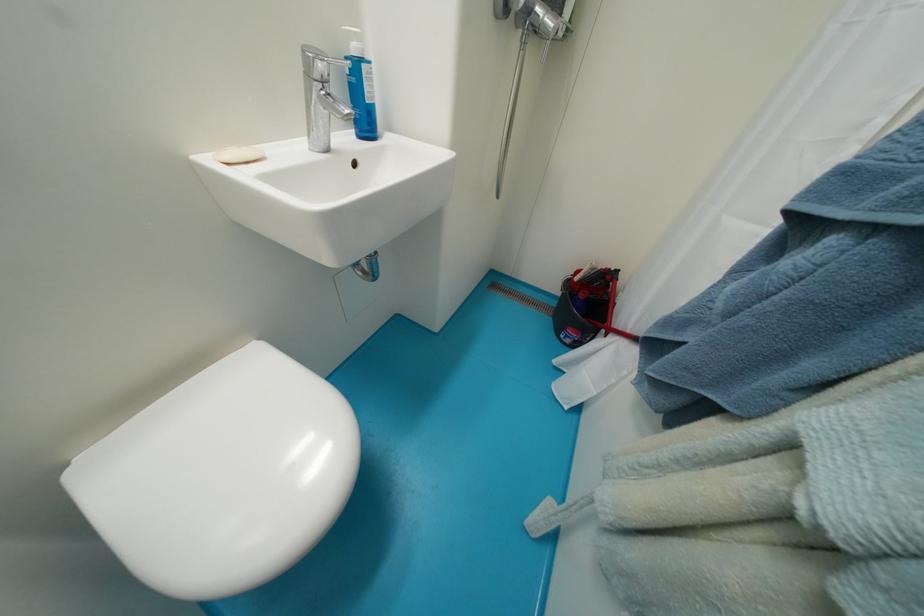
You are a GUI agent. You are given a task and a screenshot of the screen. Output one action in this format:
    pyautogui.click(x=<x>, y=<y>)
    Task: Click on the shower head handle
    This screenshot has height=616, width=924.
    Given the screenshot: What is the action you would take?
    pyautogui.click(x=556, y=6)